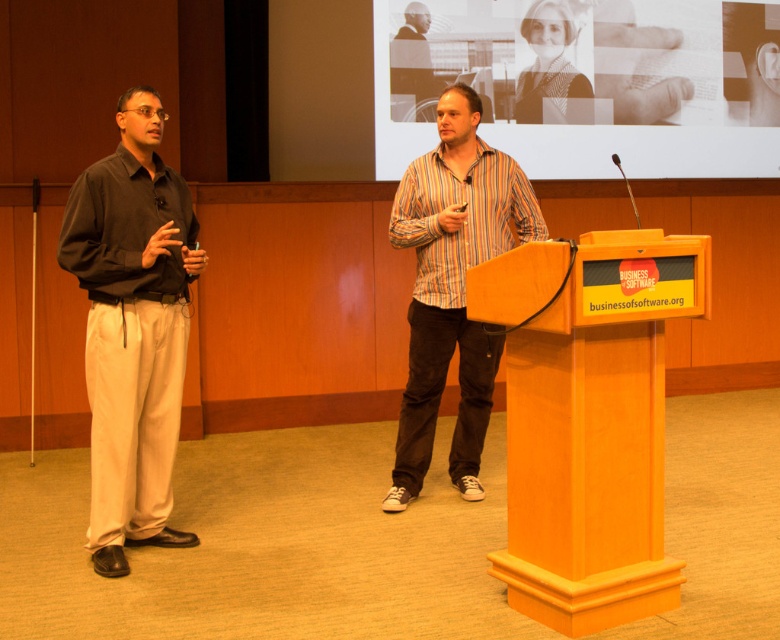
Question: Does wooden podium at center appear on the right side of striped cotton shirt at center?

Choices:
 (A) yes
 (B) no

Answer: (A)

Question: Is dark brown cotton shirt at left positioned behind striped cotton shirt at center?

Choices:
 (A) no
 (B) yes

Answer: (A)

Question: From the image, what is the correct spatial relationship of wooden podium at center in relation to dark brown cotton shirt at left?

Choices:
 (A) above
 (B) below

Answer: (B)

Question: Which of the following is the farthest from the observer?

Choices:
 (A) (644, 122)
 (B) (646, 275)
 (C) (427, 291)

Answer: (A)

Question: Which is nearer to the brown textured fabric at upper center?

Choices:
 (A) dark brown cotton shirt at left
 (B) wooden podium at center
 (C) striped cotton shirt at center

Answer: (C)

Question: Estimate the real-world distances between objects in this image. Which object is closer to the wooden podium at center?

Choices:
 (A) brown textured fabric at upper center
 (B) striped cotton shirt at center

Answer: (B)